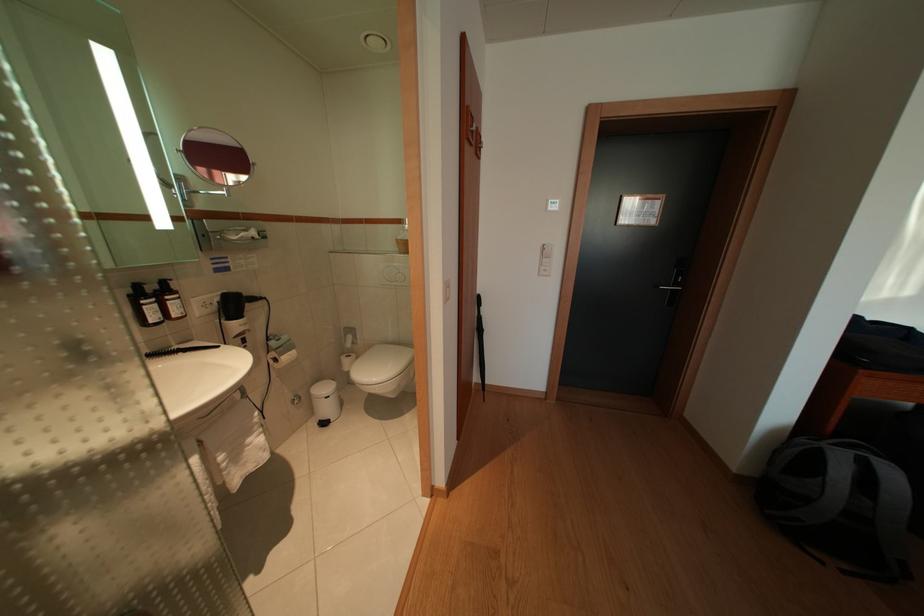
Where would you push the silver door handle? Please return your answer as a coordinate pair (x, y).

(673, 288)